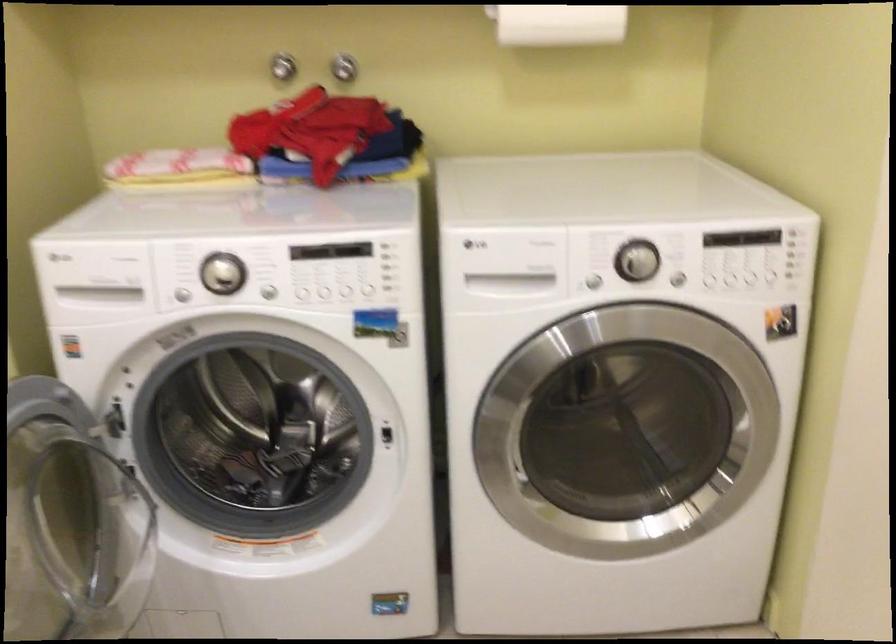
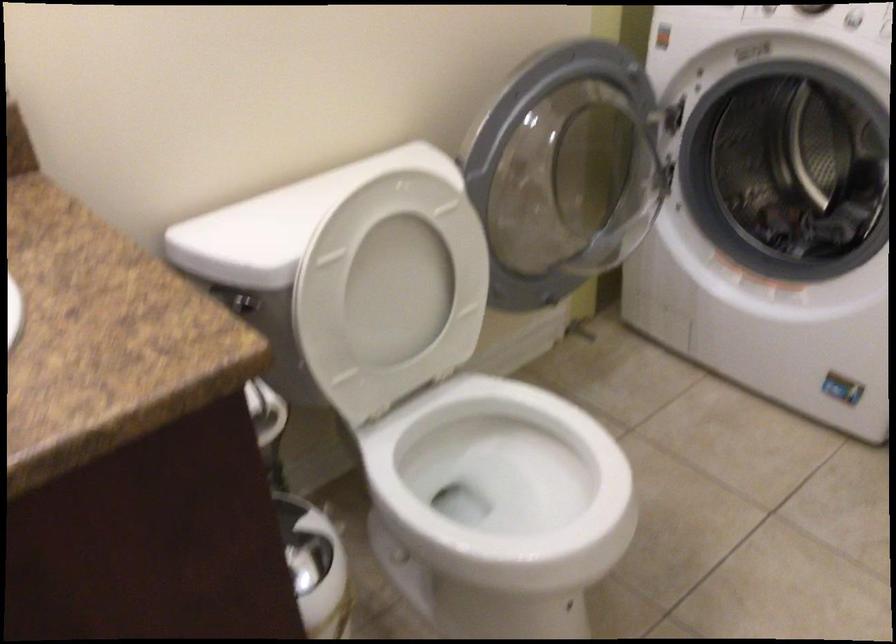
First-person continuous shooting, in which direction is the camera rotating?

The camera rotated toward left-down.